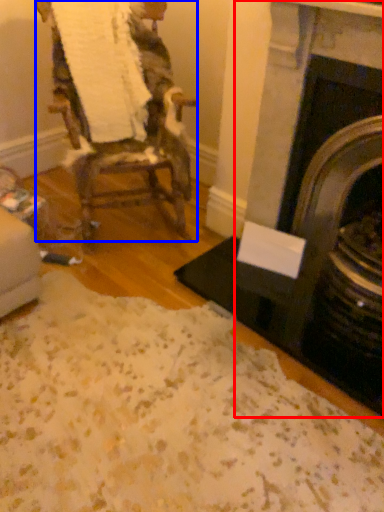
Question: Which object appears farthest to the camera in this image, fireplace (highlighted by a red box) or chair (highlighted by a blue box)?

Choices:
 (A) fireplace
 (B) chair

Answer: (B)